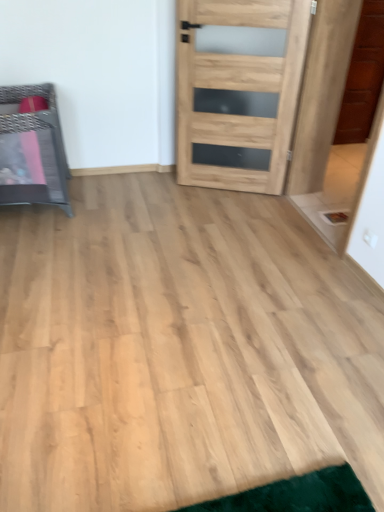
The height and width of the screenshot is (512, 384). I want to click on free spot in front of metallic woven basket at left, so click(x=45, y=241).